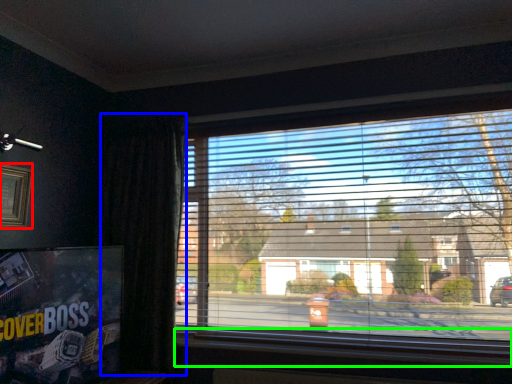
Question: Which object is positioned closest to picture frame (highlighted by a red box)? Select from curtain (highlighted by a blue box) and window sill (highlighted by a green box).

Choices:
 (A) curtain
 (B) window sill

Answer: (A)